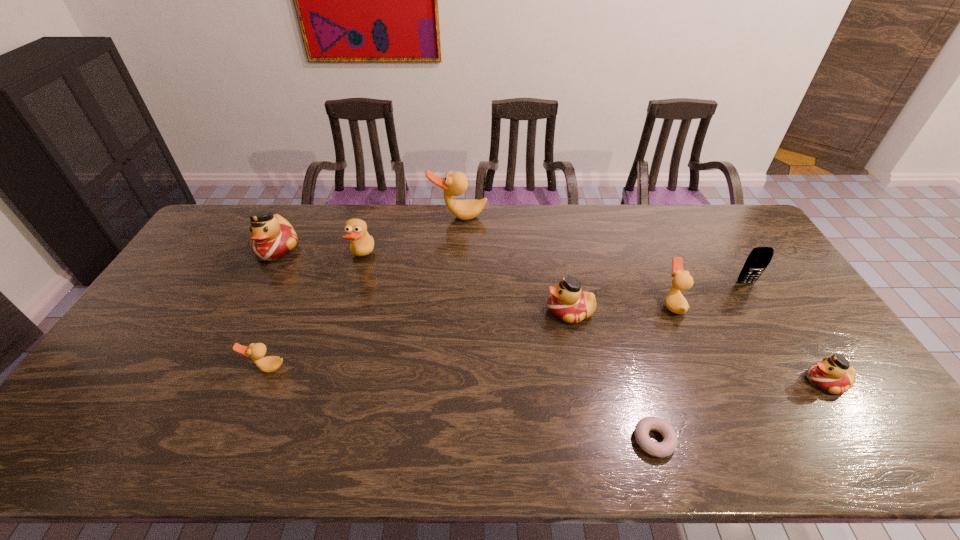
I want to click on free space between the leftmost object and the nearest tan duck, so click(272, 308).

Find the location of a particular element. This screenshot has height=540, width=960. vacant area that lies between the second duck from right to left and the cellular telephone is located at coordinates (x=709, y=293).

Identify the location of unoccupied area between the fourth farthest object and the third duck from right to left. The image size is (960, 540). (658, 297).

I want to click on vacant space that's between the cellular telephone and the second tan duck from left to right, so click(x=554, y=270).

Where is `free space between the biggest tan duck and the shortest object`? free space between the biggest tan duck and the shortest object is located at coordinates (556, 328).

I want to click on free space between the leftmost red duck and the brown doughnut, so click(x=466, y=344).

Where is `free space that is in between the cellular telephone and the leftmost red duck`? free space that is in between the cellular telephone and the leftmost red duck is located at coordinates (512, 266).

The width and height of the screenshot is (960, 540). Find the location of `vacant area that lies between the fifth object from left to right and the fourth duck from left to right`. vacant area that lies between the fifth object from left to right and the fourth duck from left to right is located at coordinates (515, 264).

Find the location of `free spot between the leftmost object and the fourth farthest object`. free spot between the leftmost object and the fourth farthest object is located at coordinates (512, 266).

Select which object is the fifth closest to the second duck from right to left. Please provide its 2D coordinates. Your answer should be formatted as a tuple, i.e. [(x, y)], where the tuple contains the x and y coordinates of a point satisfying the conditions above.

[(454, 184)]